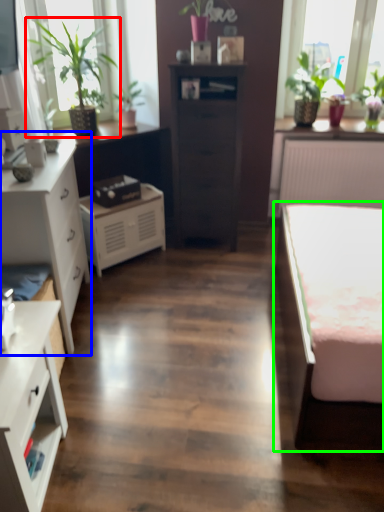
Question: Based on their relative distances, which object is nearer to houseplant (highlighted by a red box)? Choose from chest of drawers (highlighted by a blue box) and bed (highlighted by a green box).

Choices:
 (A) chest of drawers
 (B) bed

Answer: (A)